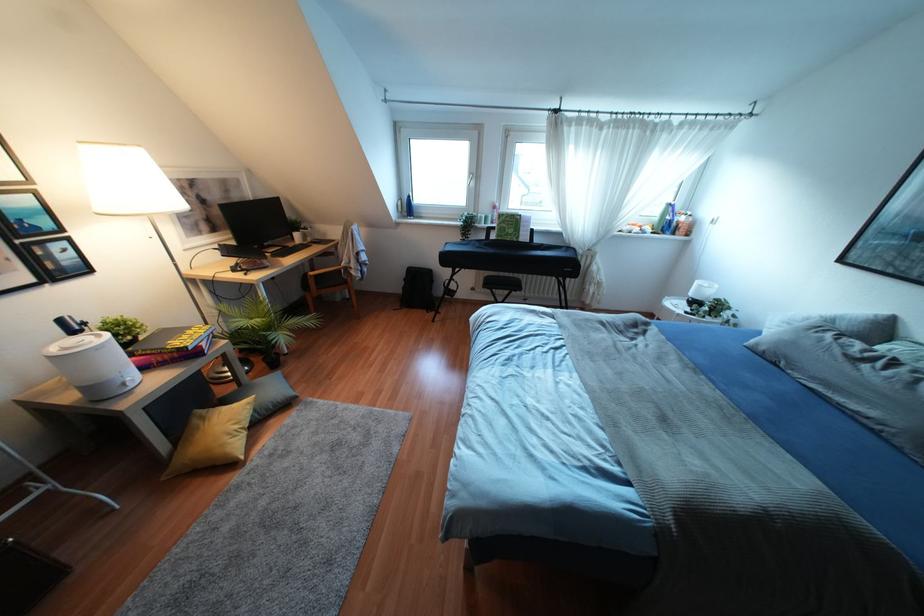
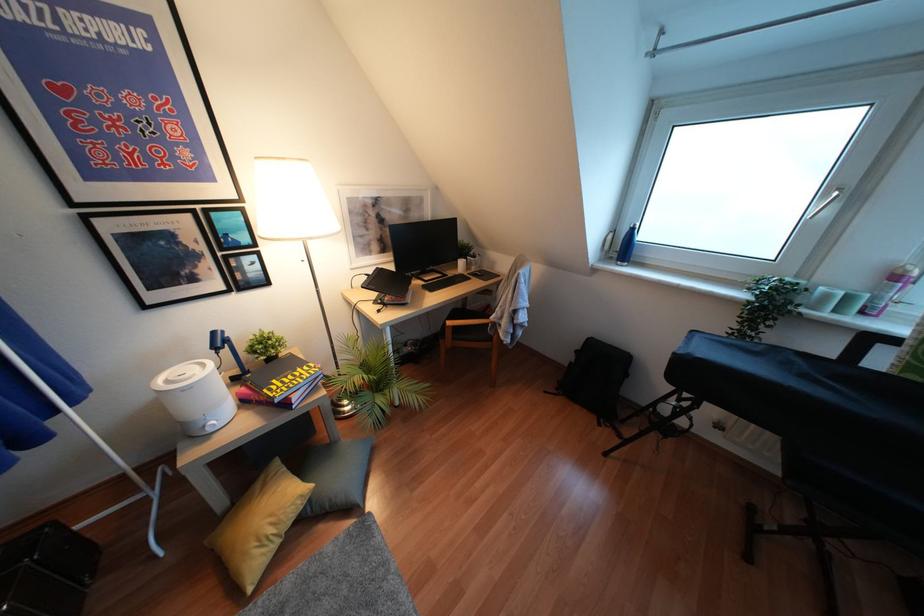
In the second image, find the point that corresponds to point 130,385 in the first image.

(210, 430)